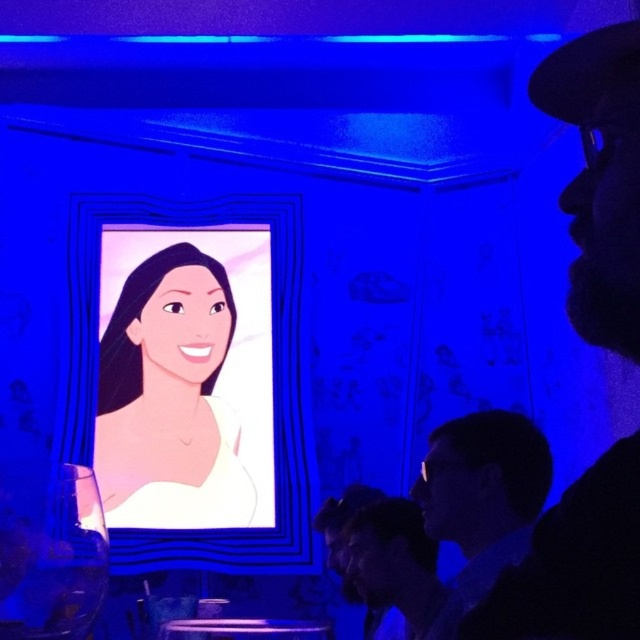
You are at an event and want to find the smooth cream dress at center. According to the coordinates provided, where should you look?

The smooth cream dress at center is located at coordinates point (x=170, y=400).